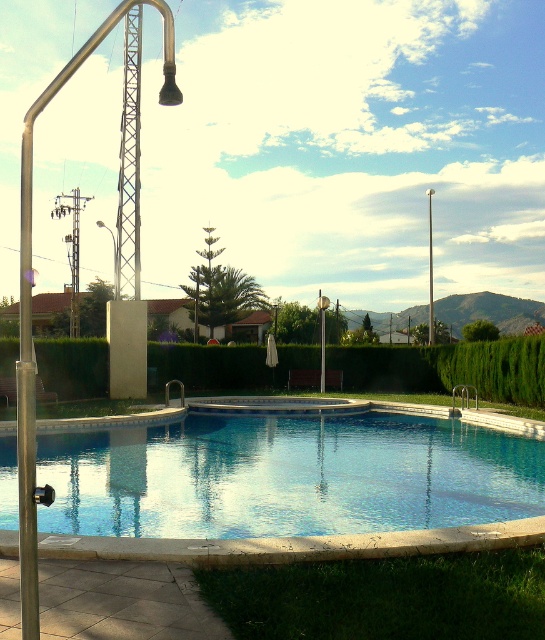
Which is above, transparent glass pool at center or smooth white pole at upper center?

smooth white pole at upper center is above.

This screenshot has height=640, width=545. Describe the element at coordinates (287, 476) in the screenshot. I see `transparent glass pool at center` at that location.

Identify the location of transparent glass pool at center. This screenshot has width=545, height=640. (287, 476).

Does transparent glass pool at center have a larger size compared to silver metallic pole at left?

No.

Can you confirm if transparent glass pool at center is thinner than silver metallic pole at left?

Correct, transparent glass pool at center's width is less than silver metallic pole at left's.

Measure the distance between point (166, 480) and camera.

Point (166, 480) is 11.78 meters from camera.

Find the location of a particular element. The image size is (545, 640). transparent glass pool at center is located at coordinates (287, 476).

Is silver metallic pole at left below smooth white pole at upper center?

Actually, silver metallic pole at left is above smooth white pole at upper center.

Which is in front, point (19, 376) or point (432, 305)?

Point (19, 376) is in front.

In order to click on silver metallic pole at left in this screenshot , I will do click(x=29, y=301).